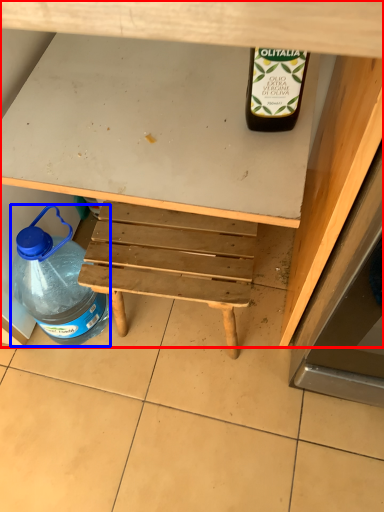
Question: Which object is further to the camera taking this photo, desk (highlighted by a red box) or bottle (highlighted by a blue box)?

Choices:
 (A) desk
 (B) bottle

Answer: (B)